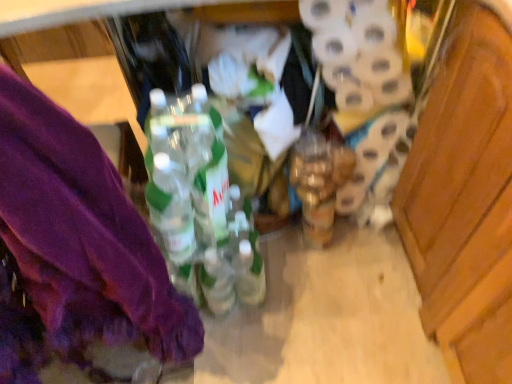
Question: Is translucent plastic bottles at center outside white matte toilet paper at center right?

Choices:
 (A) yes
 (B) no

Answer: (A)

Question: From the image's perspective, is translucent plastic bottles at center above white matte toilet paper at center right?

Choices:
 (A) no
 (B) yes

Answer: (A)

Question: Considering the relative positions of translucent plastic bottles at center and white matte toilet paper at center right in the image provided, is translucent plastic bottles at center to the right of white matte toilet paper at center right from the viewer's perspective?

Choices:
 (A) no
 (B) yes

Answer: (A)

Question: Is white matte toilet paper at center right inside translucent plastic bottles at center?

Choices:
 (A) yes
 (B) no

Answer: (B)

Question: Is the depth of translucent plastic bottles at center less than that of white matte toilet paper at center right?

Choices:
 (A) no
 (B) yes

Answer: (B)

Question: Is purple fabric at left in front of or behind translucent plastic bottles at center in the image?

Choices:
 (A) front
 (B) behind

Answer: (A)

Question: Would you say purple fabric at left is to the left or to the right of translucent plastic bottles at center in the picture?

Choices:
 (A) right
 (B) left

Answer: (B)

Question: Considering the positions of point [x=41, y=309] and point [x=221, y=309], is point [x=41, y=309] closer or farther from the camera than point [x=221, y=309]?

Choices:
 (A) farther
 (B) closer

Answer: (B)

Question: In terms of width, does purple fabric at left look wider or thinner when compared to translucent plastic bottles at center?

Choices:
 (A) wide
 (B) thin

Answer: (A)

Question: From the image's perspective, relative to white matte toilet paper at center right, is translucent plastic bottles at center above or below?

Choices:
 (A) above
 (B) below

Answer: (B)

Question: In terms of size, does translucent plastic bottles at center appear bigger or smaller than white matte toilet paper at center right?

Choices:
 (A) big
 (B) small

Answer: (A)

Question: In terms of height, does translucent plastic bottles at center look taller or shorter compared to white matte toilet paper at center right?

Choices:
 (A) short
 (B) tall

Answer: (B)

Question: Considering the positions of point (152, 122) and point (406, 51), is point (152, 122) closer or farther from the camera than point (406, 51)?

Choices:
 (A) closer
 (B) farther

Answer: (A)

Question: Considering their positions, is white matte toilet paper at center right located in front of or behind translucent plastic bottles at center?

Choices:
 (A) front
 (B) behind

Answer: (B)

Question: From a real-world perspective, is white matte toilet paper at center right above or below translucent plastic bottles at center?

Choices:
 (A) below
 (B) above

Answer: (B)